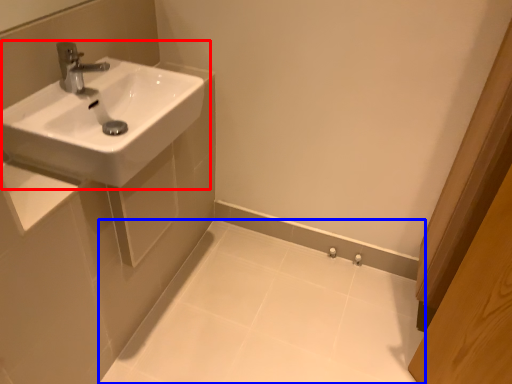
Question: Which object is closer to the camera taking this photo, sink (highlighted by a red box) or porcelain (highlighted by a blue box)?

Choices:
 (A) sink
 (B) porcelain

Answer: (A)